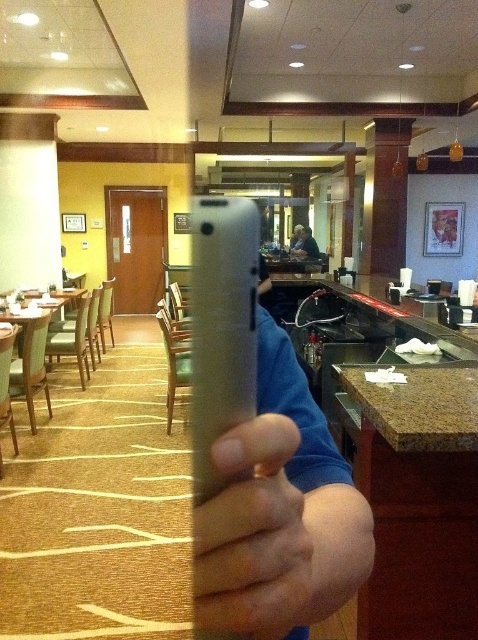
Question: Among these objects, which one is farthest from the camera?

Choices:
 (A) matte gray phone at center
 (B) blue cotton shirt at center

Answer: (B)

Question: Is matte gray phone at center closer to the viewer compared to blue cotton shirt at center?

Choices:
 (A) no
 (B) yes

Answer: (B)

Question: Which of the following is the farthest from the observer?

Choices:
 (A) matte gray phone at center
 (B) blue cotton shirt at center

Answer: (B)

Question: Which object appears farthest from the camera in this image?

Choices:
 (A) matte gray phone at center
 (B) blue cotton shirt at center

Answer: (B)

Question: Can you confirm if matte gray phone at center is wider than blue cotton shirt at center?

Choices:
 (A) yes
 (B) no

Answer: (B)

Question: Considering the relative positions of matte gray phone at center and blue cotton shirt at center in the image provided, where is matte gray phone at center located with respect to blue cotton shirt at center?

Choices:
 (A) below
 (B) above

Answer: (A)